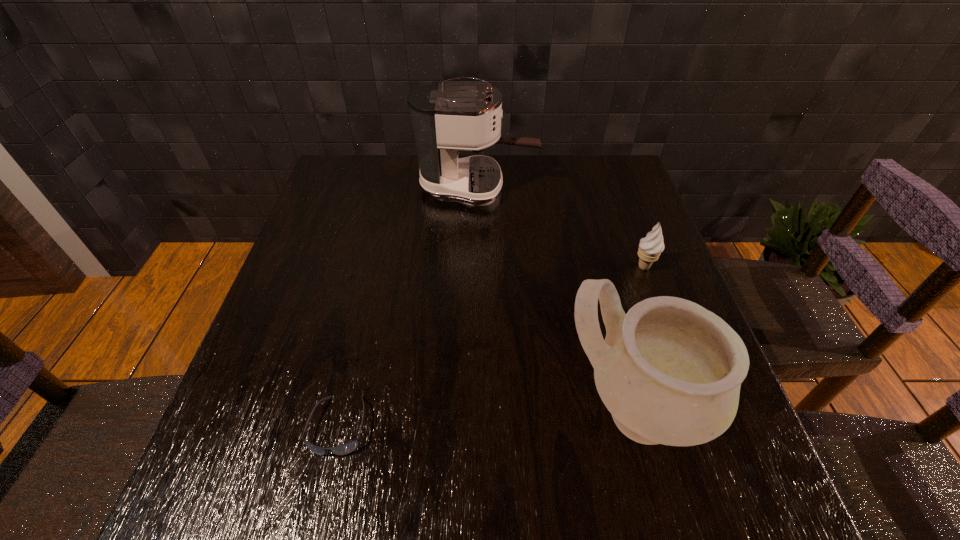
Identify the location of vacant area located 0.380m on the front-facing side of the second shortest object. The image size is (960, 540). (476, 267).

The height and width of the screenshot is (540, 960). In order to click on object located in the far edge section of the desktop in this screenshot , I will do (x=446, y=117).

Identify the location of object present at the near edge. The height and width of the screenshot is (540, 960). 669,371.

Where is `object that is at the left edge`? object that is at the left edge is located at coordinates (346, 448).

You are a GUI agent. You are given a task and a screenshot of the screen. Output one action in this format:
    pyautogui.click(x=<x>, y=<y>)
    Task: Click on the pottery situated at the right edge
    
    Given the screenshot: What is the action you would take?
    pyautogui.click(x=669, y=371)

At what (x,y) coordinates should I click in order to perform the action: click on icecream at the right edge. Please return your answer as a coordinate pair (x, y). The width and height of the screenshot is (960, 540). Looking at the image, I should click on (650, 247).

Where is `object present at the near right corner`? Image resolution: width=960 pixels, height=540 pixels. object present at the near right corner is located at coordinates (669, 371).

Identify the location of vacant space at the far edge of the desktop. (561, 192).

Where is `free spot at the near edge of the desktop`? free spot at the near edge of the desktop is located at coordinates (448, 475).

The image size is (960, 540). Find the location of `vacant space at the left edge of the desktop`. vacant space at the left edge of the desktop is located at coordinates (310, 366).